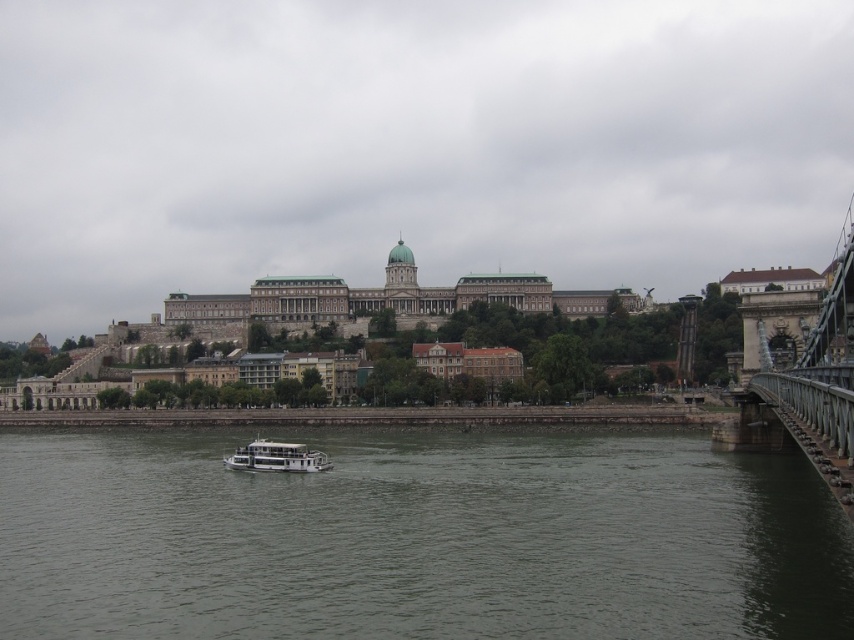
You are standing at the point with coordinates [417,538] in the riverside scene. What is the immediate surface you are standing on?

The point at [417,538] corresponds to gray water at center, so you are standing on the gray water at center.

You are a tourist standing on the riverside and want to take a photo of the white matte boat at center and the gray water at center. Which object should you focus on first if you want to capture both in one frame without moving your camera?

You should focus on the white matte boat at center first because the gray water at center is below it, so adjusting the focus to the boat ensures both the boat and the water beneath it are in the frame without needing to reposition the camera.